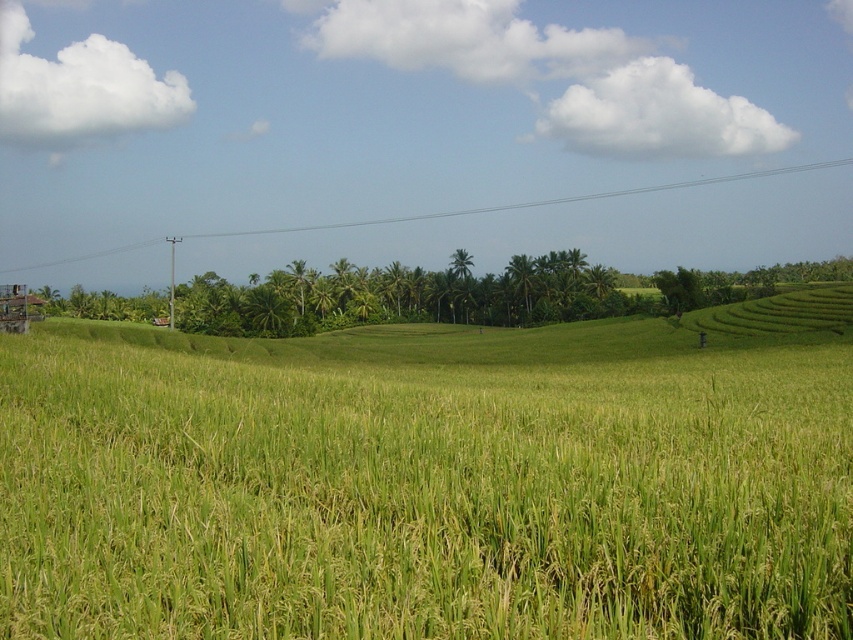
Is green grassy field at center closer to camera compared to clear plastic power line at upper center?

Yes.

Does green grassy field at center have a greater height compared to clear plastic power line at upper center?

In fact, green grassy field at center may be shorter than clear plastic power line at upper center.

Find the location of a particular element. This screenshot has width=853, height=640. green grassy field at center is located at coordinates point(422,483).